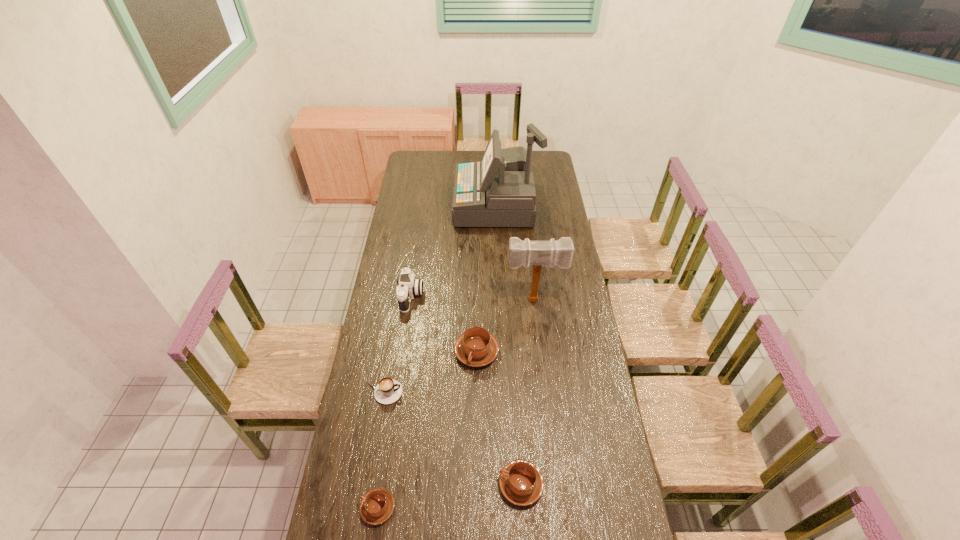
Identify which object is located as the third nearest to the black cappuccino. Please provide its 2D coordinates. Your answer should be formatted as a tuple, i.e. [(x, y)], where the tuple contains the x and y coordinates of a point satisfying the conditions above.

[(408, 286)]

The width and height of the screenshot is (960, 540). In order to click on cappuccino object that ranks as the closest to the smallest brown cappuccino in this screenshot , I will do `click(388, 390)`.

Identify which cappuccino is the fourth nearest to the second tallest object. Please provide its 2D coordinates. Your answer should be formatted as a tuple, i.e. [(x, y)], where the tuple contains the x and y coordinates of a point satisfying the conditions above.

[(377, 505)]

Locate which brown cappuccino is the third closest to the wood mallet. Please provide its 2D coordinates. Your answer should be formatted as a tuple, i.e. [(x, y)], where the tuple contains the x and y coordinates of a point satisfying the conditions above.

[(377, 505)]

Choose which brown cappuccino is the second nearest neighbor to the tallest cappuccino. Please provide its 2D coordinates. Your answer should be formatted as a tuple, i.e. [(x, y)], where the tuple contains the x and y coordinates of a point satisfying the conditions above.

[(377, 505)]

Find the location of a particular element. Image resolution: width=960 pixels, height=540 pixels. vacant space that satisfies the following two spatial constraints: 1. on the side of the biggest brown cappuccino with the handle; 2. with the handle on the side of the third nearest object is located at coordinates (476, 392).

The image size is (960, 540). Find the location of `free space that satisfies the following two spatial constraints: 1. on the customer-facing side of the second tallest object; 2. on the right side of the farthest object`. free space that satisfies the following two spatial constraints: 1. on the customer-facing side of the second tallest object; 2. on the right side of the farthest object is located at coordinates (499, 300).